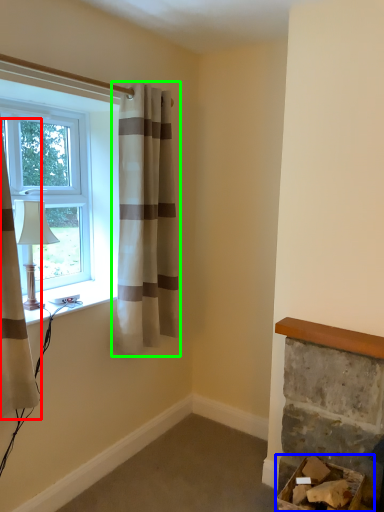
Question: Which object is the farthest from curtain (highlighted by a red box)? Choose among these: furniture (highlighted by a blue box) or curtain (highlighted by a green box).

Choices:
 (A) furniture
 (B) curtain

Answer: (A)